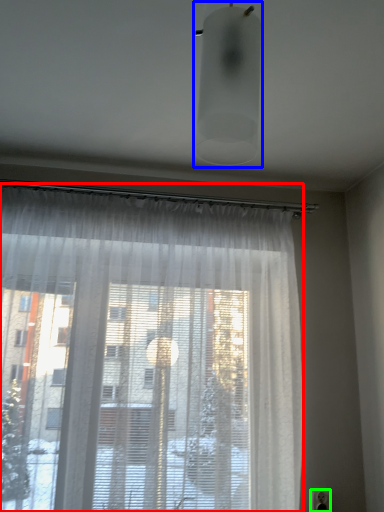
Question: Considering the real-world distances, which object is closest to curtain (highlighted by a red box)? light fixture (highlighted by a blue box) or electric outlet (highlighted by a green box).

Choices:
 (A) light fixture
 (B) electric outlet

Answer: (A)